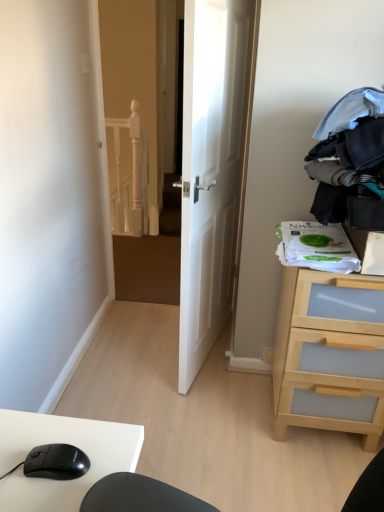
Question: Is white glossy door at center thinner than light wood/transparent drawer at right?

Choices:
 (A) no
 (B) yes

Answer: (B)

Question: Is white glossy door at center aimed at light wood/transparent drawer at right?

Choices:
 (A) no
 (B) yes

Answer: (A)

Question: Can you confirm if white glossy door at center is bigger than light wood/transparent drawer at right?

Choices:
 (A) no
 (B) yes

Answer: (B)

Question: From a real-world perspective, is white glossy door at center on top of light wood/transparent drawer at right?

Choices:
 (A) yes
 (B) no

Answer: (A)

Question: From the image's perspective, is white glossy door at center below light wood/transparent drawer at right?

Choices:
 (A) yes
 (B) no

Answer: (B)

Question: Is black matte mouse at lower left wider or thinner than light wood/transparent drawer at right?

Choices:
 (A) wide
 (B) thin

Answer: (B)

Question: Looking at the image, does black matte mouse at lower left seem bigger or smaller compared to light wood/transparent drawer at right?

Choices:
 (A) big
 (B) small

Answer: (B)

Question: Visually, is black matte mouse at lower left positioned to the left or to the right of light wood/transparent drawer at right?

Choices:
 (A) right
 (B) left

Answer: (B)

Question: Is black matte mouse at lower left in front of or behind light wood/transparent drawer at right in the image?

Choices:
 (A) front
 (B) behind

Answer: (A)

Question: From the image's perspective, relative to white glossy door at center, is dark blue fabric at upper right above or below?

Choices:
 (A) above
 (B) below

Answer: (A)

Question: From their relative heights in the image, would you say dark blue fabric at upper right is taller or shorter than white glossy door at center?

Choices:
 (A) tall
 (B) short

Answer: (B)

Question: Is dark blue fabric at upper right bigger or smaller than white glossy door at center?

Choices:
 (A) small
 (B) big

Answer: (A)

Question: Is dark blue fabric at upper right to the left or to the right of white glossy door at center in the image?

Choices:
 (A) left
 (B) right

Answer: (B)

Question: In terms of width, does black matte mouse at lower left look wider or thinner when compared to dark blue fabric at upper right?

Choices:
 (A) thin
 (B) wide

Answer: (A)

Question: Based on their sizes in the image, would you say black matte mouse at lower left is bigger or smaller than dark blue fabric at upper right?

Choices:
 (A) big
 (B) small

Answer: (B)